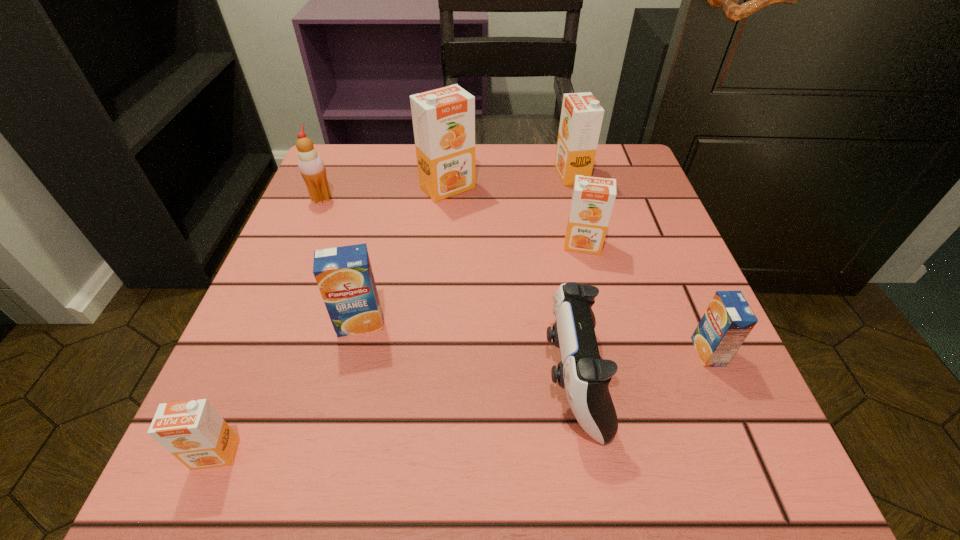
Locate an element on the screen. This screenshot has width=960, height=540. vacant space located on the front-facing side of the control is located at coordinates (295, 380).

At what (x,y) coordinates should I click in order to perform the action: click on vacant space located 0.150m on the right of the smallest orange orange juice. Please return your answer as a coordinate pair (x, y). This screenshot has width=960, height=540. Looking at the image, I should click on (355, 454).

I want to click on free region located 0.340m on the back of the rightmost object, so click(x=645, y=205).

Identify the location of icecream that is at the far edge. The width and height of the screenshot is (960, 540). (311, 166).

You are a GUI agent. You are given a task and a screenshot of the screen. Output one action in this format:
    pyautogui.click(x=<x>, y=<y>)
    Task: Click on the control situated at the near edge
    This screenshot has width=960, height=540.
    Given the screenshot: What is the action you would take?
    pyautogui.click(x=582, y=373)

Find the location of a particular element. orange juice that is positioned at the near edge is located at coordinates (193, 431).

Locate an element on the screen. icecream that is at the left edge is located at coordinates (311, 166).

Identify the location of object located at the far left corner. Image resolution: width=960 pixels, height=540 pixels. (311, 166).

Where is `object present at the near left corner`? Image resolution: width=960 pixels, height=540 pixels. object present at the near left corner is located at coordinates [x=193, y=431].

Identify the location of object that is at the far right corner. This screenshot has width=960, height=540. (581, 119).